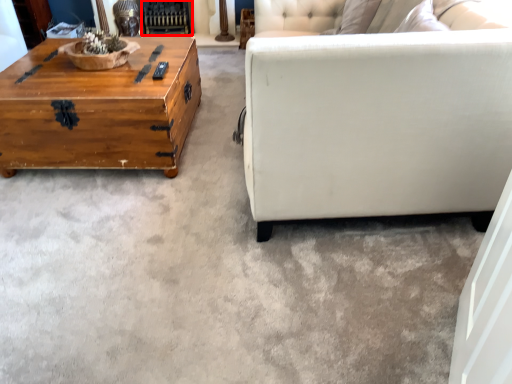
Question: In this image, where is fireplace (annotated by the red box) located relative to coffee table?

Choices:
 (A) left
 (B) right

Answer: (B)